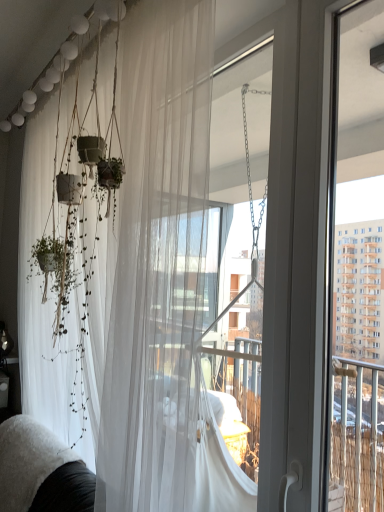
Question: Can you confirm if white fluffy couch at lower left is wider than translucent white curtain at left?

Choices:
 (A) yes
 (B) no

Answer: (B)

Question: Is white fluffy couch at lower left far away from translucent white curtain at left?

Choices:
 (A) yes
 (B) no

Answer: (B)

Question: Does white fluffy couch at lower left lie in front of translucent white curtain at left?

Choices:
 (A) no
 (B) yes

Answer: (A)

Question: Can you confirm if white fluffy couch at lower left is positioned to the left of translucent white curtain at left?

Choices:
 (A) yes
 (B) no

Answer: (A)

Question: Is the depth of white fluffy couch at lower left greater than that of translucent white curtain at left?

Choices:
 (A) yes
 (B) no

Answer: (A)

Question: From a real-world perspective, is white fluffy couch at lower left positioned under translucent white curtain at left based on gravity?

Choices:
 (A) no
 (B) yes

Answer: (B)

Question: Is translucent white curtain at left surrounding white fluffy couch at lower left?

Choices:
 (A) yes
 (B) no

Answer: (B)

Question: Could you tell me if translucent white curtain at left is facing white fluffy couch at lower left?

Choices:
 (A) no
 (B) yes

Answer: (A)

Question: Is the position of translucent white curtain at left less distant than that of white fluffy couch at lower left?

Choices:
 (A) yes
 (B) no

Answer: (A)

Question: Is translucent white curtain at left not near white fluffy couch at lower left?

Choices:
 (A) no
 (B) yes

Answer: (A)

Question: Is translucent white curtain at left shorter than white fluffy couch at lower left?

Choices:
 (A) no
 (B) yes

Answer: (A)

Question: Does translucent white curtain at left have a greater width compared to white fluffy couch at lower left?

Choices:
 (A) yes
 (B) no

Answer: (A)

Question: Is white fluffy couch at lower left inside or outside of translucent white curtain at left?

Choices:
 (A) inside
 (B) outside

Answer: (B)